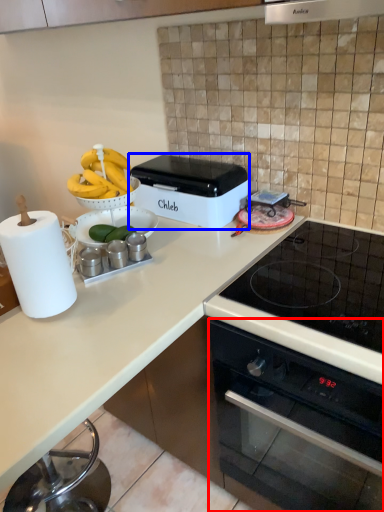
Question: Which object is closer to the camera taking this photo, oven (highlighted by a red box) or kitchen appliance (highlighted by a blue box)?

Choices:
 (A) oven
 (B) kitchen appliance

Answer: (A)